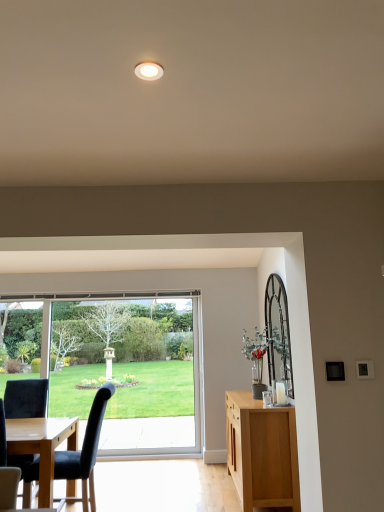
Question: Does clear glass window at center contain white glossy light fixture at upper center?

Choices:
 (A) no
 (B) yes

Answer: (A)

Question: Is clear glass window at center not inside white glossy light fixture at upper center?

Choices:
 (A) yes
 (B) no

Answer: (A)

Question: Considering the relative sizes of clear glass window at center and white glossy light fixture at upper center in the image provided, is clear glass window at center thinner than white glossy light fixture at upper center?

Choices:
 (A) yes
 (B) no

Answer: (A)

Question: Considering the relative positions of clear glass window at center and white glossy light fixture at upper center in the image provided, is clear glass window at center to the left of white glossy light fixture at upper center from the viewer's perspective?

Choices:
 (A) yes
 (B) no

Answer: (A)

Question: Is there a large distance between clear glass window at center and white glossy light fixture at upper center?

Choices:
 (A) no
 (B) yes

Answer: (B)

Question: From a real-world perspective, is light brown wood cabinet at right above or below clear glass window at center?

Choices:
 (A) above
 (B) below

Answer: (B)

Question: Is light brown wood cabinet at right in front of or behind clear glass window at center in the image?

Choices:
 (A) front
 (B) behind

Answer: (A)

Question: In terms of height, does light brown wood cabinet at right look taller or shorter compared to clear glass window at center?

Choices:
 (A) short
 (B) tall

Answer: (A)

Question: Looking at their shapes, would you say light brown wood cabinet at right is wider or thinner than clear glass window at center?

Choices:
 (A) thin
 (B) wide

Answer: (B)

Question: Is black fabric chair at left, which appears as the first chair when viewed from the right, wider or thinner than green leafy plant in glass vase at right?

Choices:
 (A) wide
 (B) thin

Answer: (A)

Question: Considering the relative positions of black fabric chair at left, positioned as the second chair in left-to-right order, and green leafy plant in glass vase at right in the image provided, is black fabric chair at left, positioned as the second chair in left-to-right order, to the left or to the right of green leafy plant in glass vase at right?

Choices:
 (A) right
 (B) left

Answer: (B)

Question: From the image's perspective, relative to green leafy plant in glass vase at right, is black fabric chair at left, which appears as the first chair when viewed from the right, above or below?

Choices:
 (A) above
 (B) below

Answer: (B)

Question: In terms of size, does black fabric chair at left, positioned as the second chair in left-to-right order, appear bigger or smaller than green leafy plant in glass vase at right?

Choices:
 (A) big
 (B) small

Answer: (A)

Question: Would you say black leather chair at lower left, placed as the second chair when sorted from right to left, is inside or outside green leafy plant in glass vase at right?

Choices:
 (A) inside
 (B) outside

Answer: (B)

Question: Considering the positions of black leather chair at lower left, which ranks as the first chair in left-to-right order, and green leafy plant in glass vase at right in the image, is black leather chair at lower left, which ranks as the first chair in left-to-right order, bigger or smaller than green leafy plant in glass vase at right?

Choices:
 (A) small
 (B) big

Answer: (B)